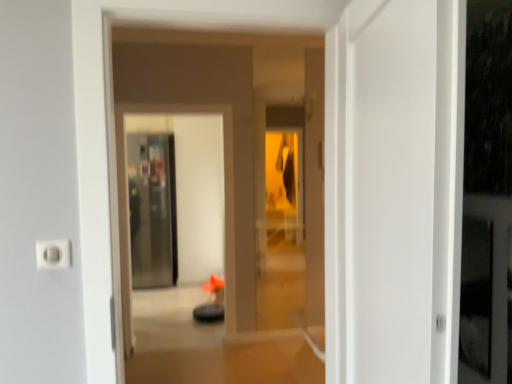
Question: Can you confirm if orange fabric chair at center is shorter than transparent glass screen door at center, the first screen door when ordered from back to front?

Choices:
 (A) yes
 (B) no

Answer: (A)

Question: Is the depth of orange fabric chair at center greater than that of transparent glass screen door at center, the first screen door when ordered from back to front?

Choices:
 (A) yes
 (B) no

Answer: (B)

Question: From a real-world perspective, is orange fabric chair at center beneath transparent glass screen door at center, which is the 2th screen door from right to left?

Choices:
 (A) yes
 (B) no

Answer: (B)

Question: From the image's perspective, is orange fabric chair at center on top of transparent glass screen door at center, the first screen door when ordered from back to front?

Choices:
 (A) no
 (B) yes

Answer: (B)

Question: Does orange fabric chair at center appear on the right side of transparent glass screen door at center, the first screen door when ordered from back to front?

Choices:
 (A) yes
 (B) no

Answer: (A)

Question: Would you say transparent glass screen door at center, which ranks as the second screen door in front-to-back order, is part of orange fabric chair at center's contents?

Choices:
 (A) no
 (B) yes

Answer: (A)

Question: Is transparent glass screen door at center, which is the first screen door from front to back, positioned with its back to orange fabric chair at center?

Choices:
 (A) yes
 (B) no

Answer: (B)

Question: Can you confirm if transparent glass screen door at center, which is the first screen door from front to back, is positioned to the right of orange fabric chair at center?

Choices:
 (A) no
 (B) yes

Answer: (A)

Question: Does transparent glass screen door at center, which appears as the second screen door when viewed from the left, appear on the left side of orange fabric chair at center?

Choices:
 (A) no
 (B) yes

Answer: (B)

Question: Can you confirm if transparent glass screen door at center, marked as the second screen door in a back-to-front arrangement, is bigger than orange fabric chair at center?

Choices:
 (A) no
 (B) yes

Answer: (B)

Question: From a real-world perspective, is transparent glass screen door at center, the 1th screen door when ordered from right to left, beneath orange fabric chair at center?

Choices:
 (A) no
 (B) yes

Answer: (B)

Question: From the image's perspective, is transparent glass screen door at center, the 1th screen door when ordered from right to left, over orange fabric chair at center?

Choices:
 (A) yes
 (B) no

Answer: (B)

Question: Can you confirm if transparent glass screen door at center, the first screen door when ordered from back to front, is thinner than white plastic electric outlet at lower left?

Choices:
 (A) no
 (B) yes

Answer: (A)